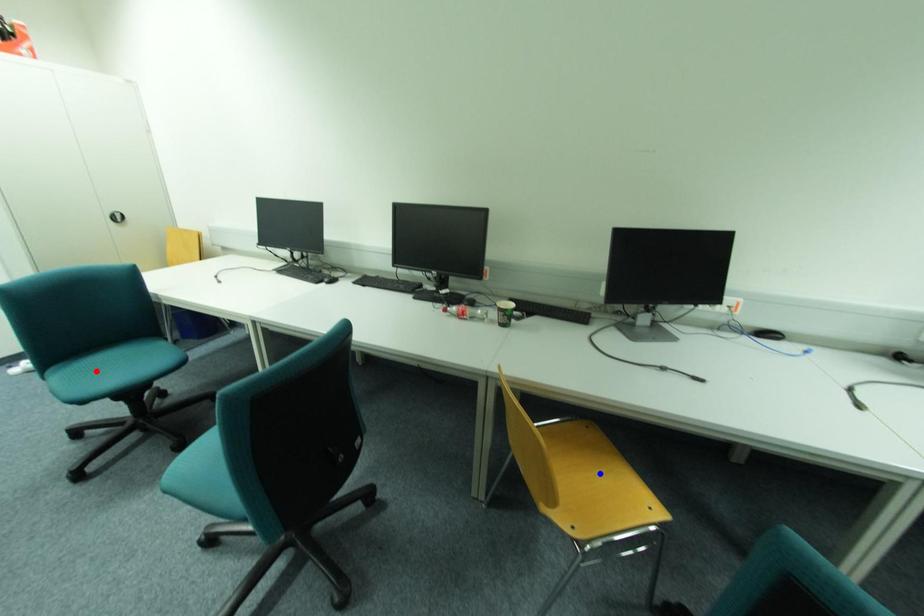
Question: In the image, two points are highlighted. Which point is nearer to the camera? Reply with the corresponding letter.

Choices:
 (A) blue point
 (B) red point

Answer: (A)